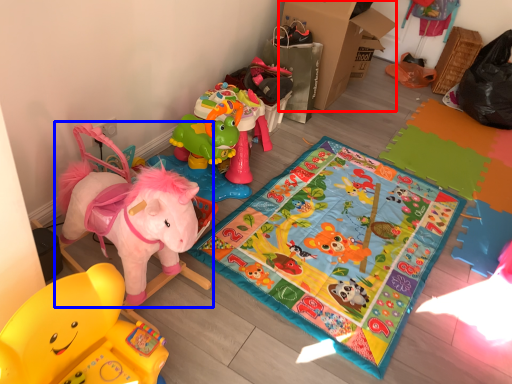
Question: Which object is closer to the camera taking this photo, cardboard box (highlighted by a red box) or toy (highlighted by a blue box)?

Choices:
 (A) cardboard box
 (B) toy

Answer: (B)